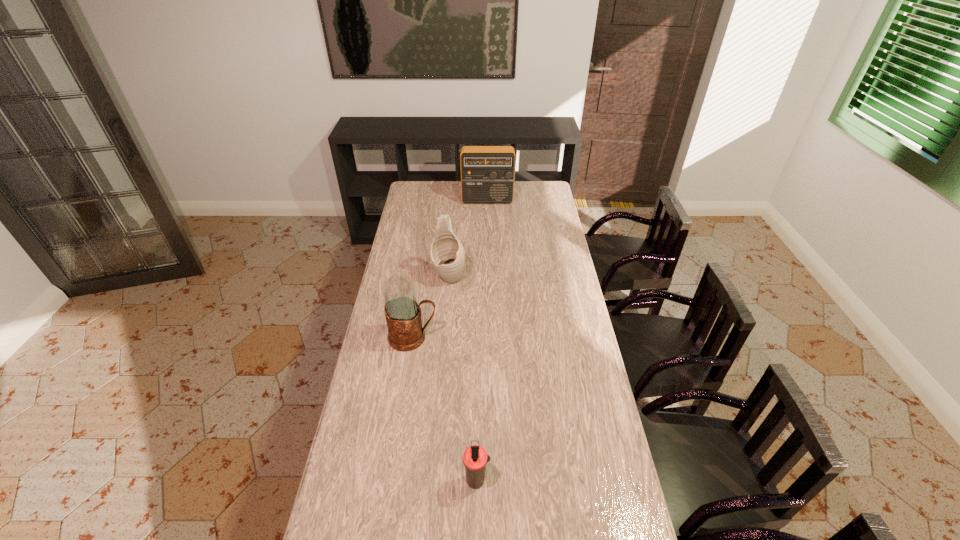
You are a GUI agent. You are given a task and a screenshot of the screen. Output one action in this format:
    pyautogui.click(x=<x>, y=<y>)
    Task: Click on the object that stands as the closest to the second farthest object
    Image resolution: width=960 pixels, height=540 pixels.
    Given the screenshot: What is the action you would take?
    pyautogui.click(x=403, y=314)

The width and height of the screenshot is (960, 540). I want to click on vacant area that satisfies the following two spatial constraints: 1. on the front-facing side of the radio receiver; 2. with the handle on the side of the third farthest object, so click(x=491, y=338).

This screenshot has width=960, height=540. Identify the location of free space that satisfies the following two spatial constraints: 1. at the spout of the second farthest object; 2. on the right side of the nearest object. (433, 480).

The width and height of the screenshot is (960, 540). Find the location of `free space that satisfies the following two spatial constraints: 1. with the handle on the side of the third farthest object; 2. on the left side of the thermos bottle`. free space that satisfies the following two spatial constraints: 1. with the handle on the side of the third farthest object; 2. on the left side of the thermos bottle is located at coordinates (392, 480).

This screenshot has width=960, height=540. In order to click on free space that satisfies the following two spatial constraints: 1. at the spout of the farther pitcher; 2. on the right side of the nearest object in this screenshot , I will do `click(433, 480)`.

At what (x,y) coordinates should I click in order to perform the action: click on free region that satisfies the following two spatial constraints: 1. with the handle on the side of the shortest object; 2. on the right side of the third farthest object. Please return your answer as a coordinate pair (x, y). This screenshot has height=540, width=960. Looking at the image, I should click on (392, 480).